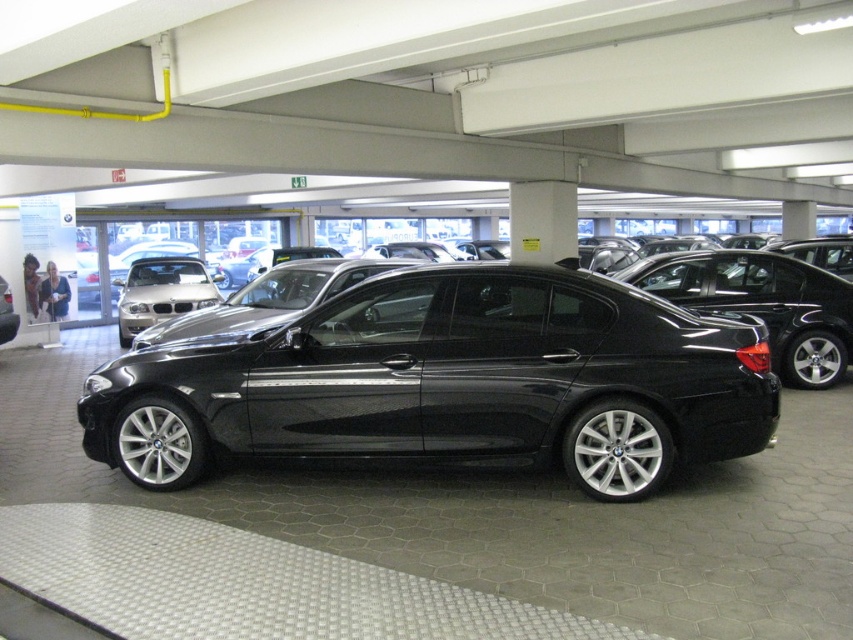
Question: In this image, where is glossy black sedan at center located relative to satin silver sedan at center?

Choices:
 (A) left
 (B) right

Answer: (B)

Question: Is glossy black sedan at center to the left of satin silver sedan at center from the viewer's perspective?

Choices:
 (A) yes
 (B) no

Answer: (B)

Question: Is glossy black sedan at center in front of satin silver sedan at center?

Choices:
 (A) yes
 (B) no

Answer: (A)

Question: Which point is closer to the camera?

Choices:
 (A) (152, 273)
 (B) (125, 464)

Answer: (B)